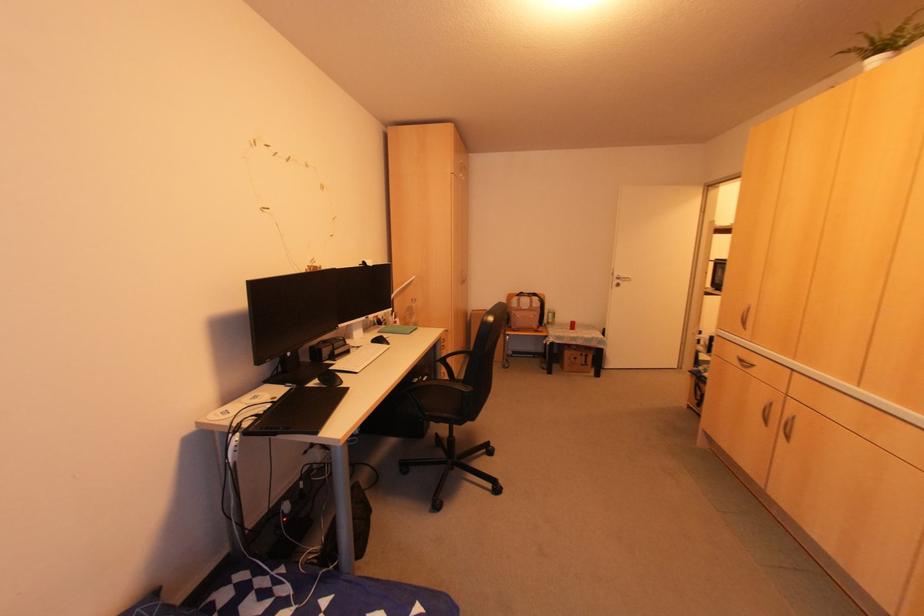
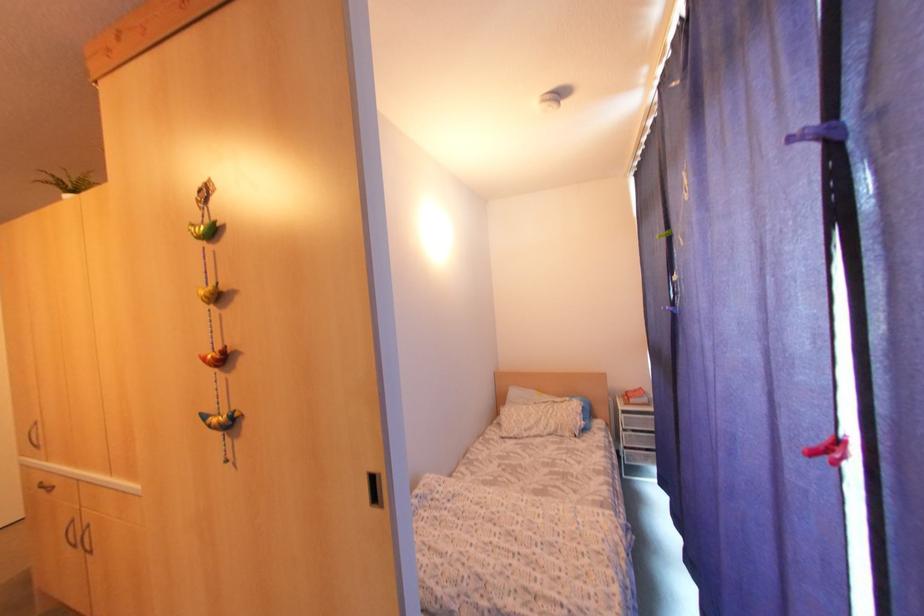
Question: The camera is either moving clockwise (left) or counter-clockwise (right) around the object. The first image is from the beginning of the video and the second image is from the end. Is the camera moving left or right when shooting the video?

Choices:
 (A) Left
 (B) Right

Answer: (A)